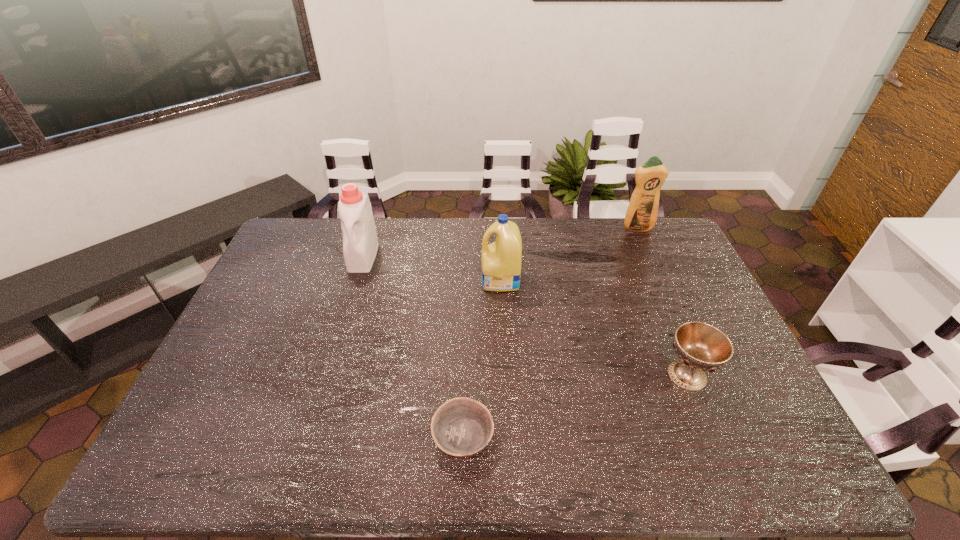
This screenshot has width=960, height=540. I want to click on vacant region that satisfies the following two spatial constraints: 1. on the handle side of the leftmost object; 2. on the right side of the chalice, so click(326, 375).

Where is `free location that satisfies the following two spatial constraints: 1. on the back side of the bowl; 2. on the right side of the second nearest object`? free location that satisfies the following two spatial constraints: 1. on the back side of the bowl; 2. on the right side of the second nearest object is located at coordinates (465, 375).

The width and height of the screenshot is (960, 540). In order to click on vacant area that satisfies the following two spatial constraints: 1. on the handle side of the second nearest object; 2. on the left side of the leftmost detergent in this screenshot , I will do `click(326, 375)`.